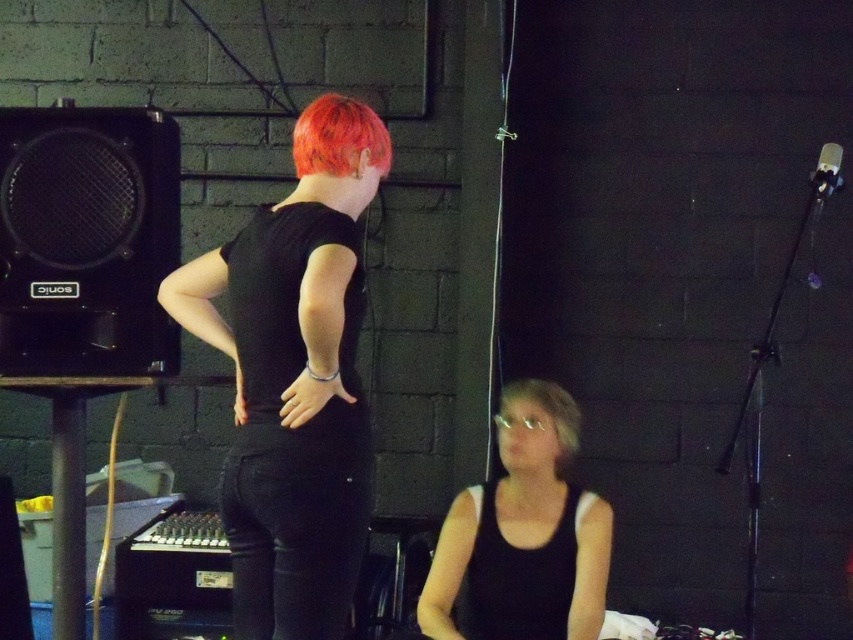
You are at a party and want to take a photo of both the black matte jeans at center and the bright orange hair at upper center. Which object should you focus on first to ensure both are in the frame?

You should focus on the black matte jeans at center first since it is to the left of bright orange hair at upper center, ensuring both are captured in the photo.

You are a photographer setting up for a photoshoot in this dimly lit indoor venue. You need to place a spotlight so it illuminates both the black matte jeans at center and the black mesh speaker at left without causing glare on any reflective surfaces. Considering their positions, which object should the spotlight be placed closer to to avoid glare?

The spotlight should be placed closer to the black mesh speaker at left because the black matte jeans at center is positioned on the right side of it, meaning the speaker is closer to the left. Since the speaker might have reflective surfaces, positioning the light closer to it can help control glare better while still illuminating both objects.